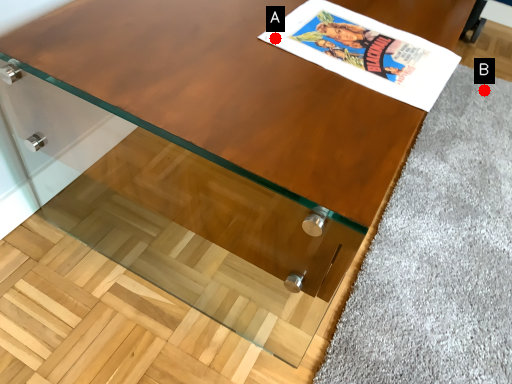
Question: Two points are circled on the image, labeled by A and B beside each circle. Which point is farther from the camera taking this photo?

Choices:
 (A) A is further
 (B) B is further

Answer: (B)